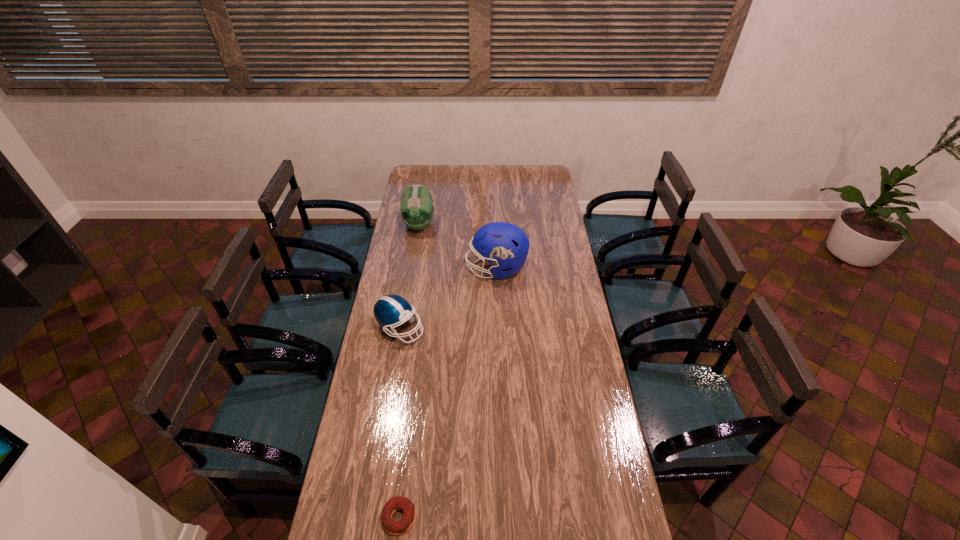
Locate an element on the screen. This screenshot has width=960, height=540. free space that satisfies the following two spatial constraints: 1. on the visor of the second tallest object; 2. at the front of the shortest football helmet with the faceguard is located at coordinates (402, 328).

Find the location of a particular element. free spot that satisfies the following two spatial constraints: 1. at the front of the second nearest object with the faceguard; 2. on the right side of the shortest object is located at coordinates (369, 517).

Image resolution: width=960 pixels, height=540 pixels. Find the location of `vacant space that satisfies the following two spatial constraints: 1. on the visor of the second shortest football helmet; 2. at the front of the second nearest object with the faceguard`. vacant space that satisfies the following two spatial constraints: 1. on the visor of the second shortest football helmet; 2. at the front of the second nearest object with the faceguard is located at coordinates (402, 328).

The height and width of the screenshot is (540, 960). I want to click on free spot that satisfies the following two spatial constraints: 1. at the front of the nearest object with the faceguard; 2. on the left side of the shortest football helmet, so click(369, 517).